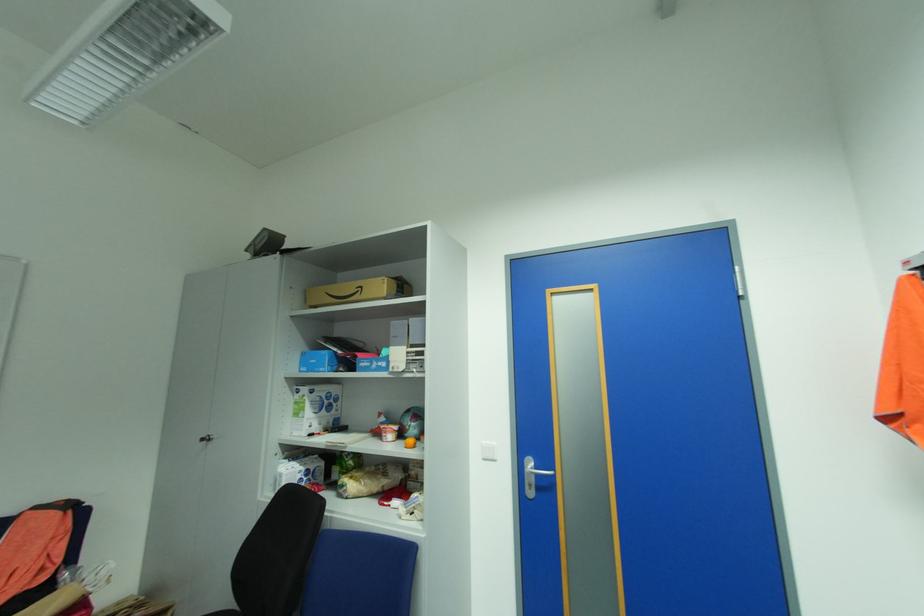
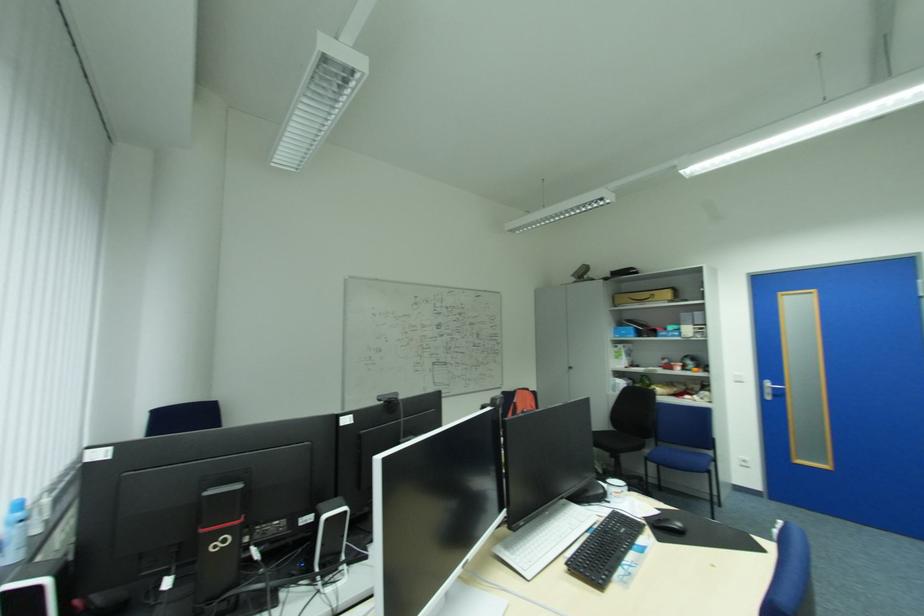
In a continuous first-person perspective shot, in which direction is the camera moving?

The cameraman moved toward left, backward.